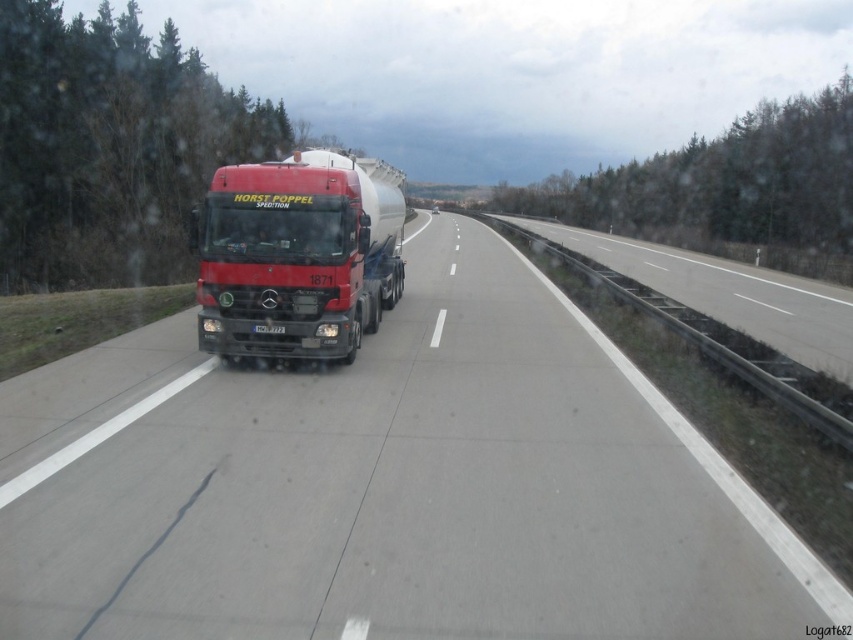
Question: Where is metallic truck at center located in relation to metallic silver tank at center in the image?

Choices:
 (A) left
 (B) right

Answer: (B)

Question: Which point is closer to the camera taking this photo?

Choices:
 (A) (346, 193)
 (B) (618, 456)

Answer: (B)

Question: Can you confirm if metallic truck at center is positioned above metallic silver tank at center?

Choices:
 (A) yes
 (B) no

Answer: (B)

Question: Does metallic truck at center appear on the right side of metallic silver tank at center?

Choices:
 (A) yes
 (B) no

Answer: (A)